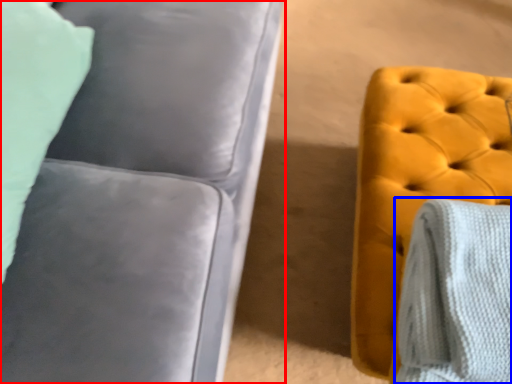
Question: Which point is closer to the camera, studio couch (highlighted by a red box) or blanket (highlighted by a blue box)?

Choices:
 (A) studio couch
 (B) blanket

Answer: (A)